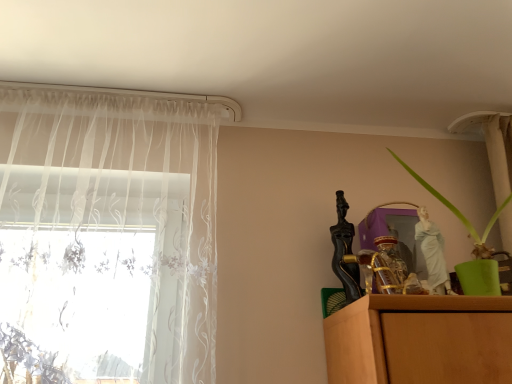
Question: Considering their positions, is green matte plant at right located in front of or behind white sheer curtain at left?

Choices:
 (A) behind
 (B) front

Answer: (B)

Question: Based on their positions, is green matte plant at right located to the left or right of white sheer curtain at left?

Choices:
 (A) right
 (B) left

Answer: (A)

Question: In terms of size, does green matte plant at right appear bigger or smaller than white sheer curtain at left?

Choices:
 (A) big
 (B) small

Answer: (B)

Question: Considering the positions of point (10, 230) and point (480, 238), is point (10, 230) closer or farther from the camera than point (480, 238)?

Choices:
 (A) closer
 (B) farther

Answer: (A)

Question: In terms of size, does white sheer curtain at left appear bigger or smaller than green matte plant at right?

Choices:
 (A) big
 (B) small

Answer: (A)

Question: Choose the correct answer: Is white sheer curtain at left inside green matte plant at right or outside it?

Choices:
 (A) inside
 (B) outside

Answer: (B)

Question: In terms of width, does white sheer curtain at left look wider or thinner when compared to green matte plant at right?

Choices:
 (A) thin
 (B) wide

Answer: (A)